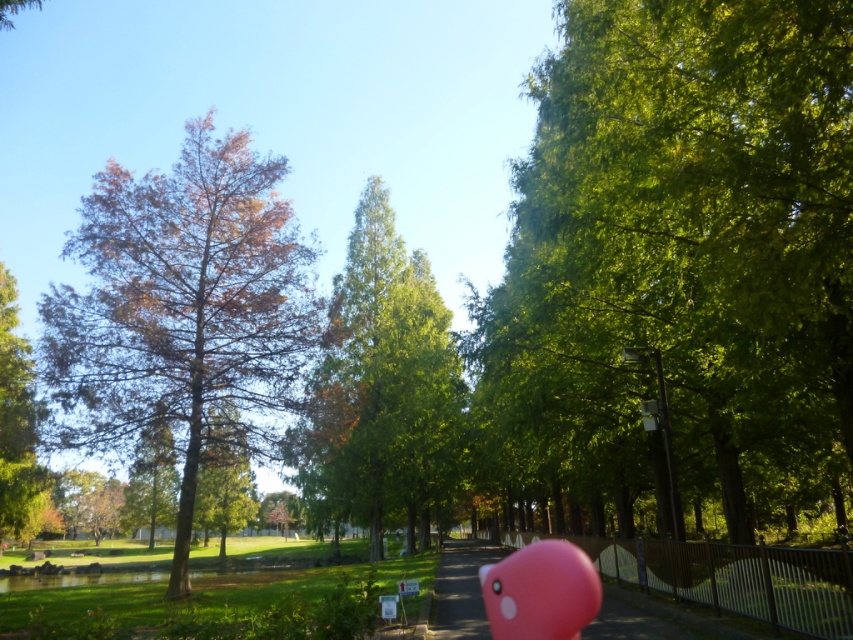
You are standing on the pathway in the park and want to take a photo of both the green leafy tree at right and the green glossy tree at left. Which tree should you position closer to the camera to include both in the frame?

To include both the green leafy tree at right and the green glossy tree at left in the frame, you should position the green leafy tree at right closer to the camera since it is positioned over the green glossy tree at left, making it appear closer in the photo.

You are standing at the viewpoint of the image and want to walk towards the two points marked in the scene. Which point would you reach first, point (834, 241) or point (33, 428)?

Point (834, 241) is closer to the camera than point (33, 428), so you would reach point (834, 241) first.

You are standing at point (183, 310) in the park. What do you see around you?

You see a brown dried leaves tree at left around you.